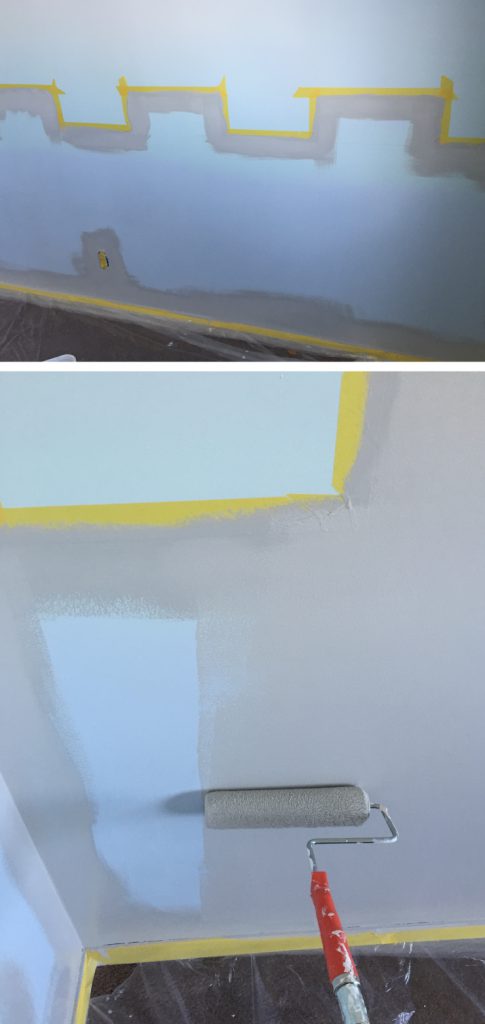
Identify the location of red section of paint roller handle. [x=331, y=919].